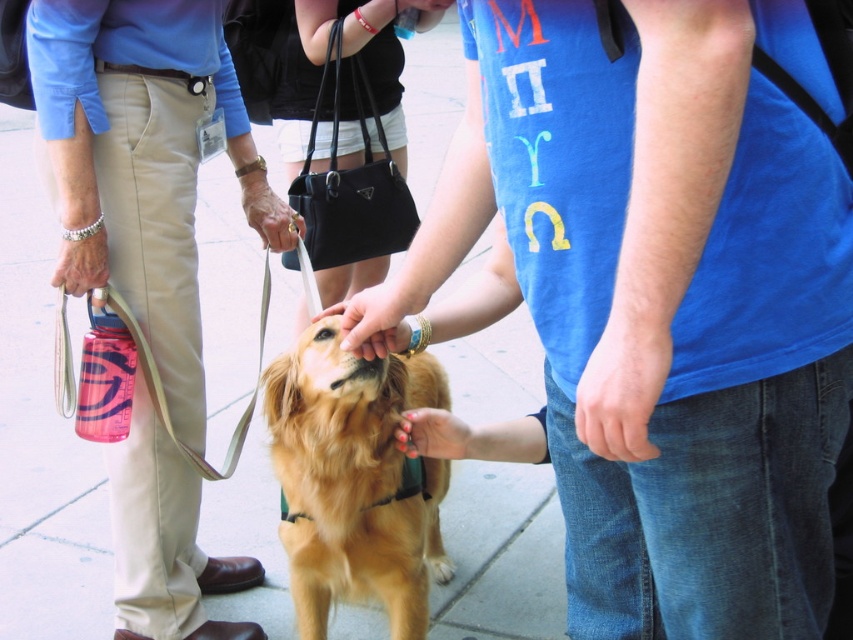
Does khaki pants at center have a lesser width compared to golden fur dog at center?

No.

I want to click on khaki pants at center, so click(143, 163).

You are a GUI agent. You are given a task and a screenshot of the screen. Output one action in this format:
    pyautogui.click(x=<x>, y=<y>)
    Task: Click on the khaki pants at center
    
    Given the screenshot: What is the action you would take?
    pyautogui.click(x=143, y=163)

How distant is blue cotton t-shirt at center from golden fur dog at center?

blue cotton t-shirt at center and golden fur dog at center are 63.50 centimeters apart from each other.

Is point (447, 253) farther from viewer compared to point (408, 524)?

No, it is in front of (408, 524).

Is point (605, 280) positioned behind point (305, 360)?

No, it is in front of (305, 360).

The width and height of the screenshot is (853, 640). Identify the location of blue cotton t-shirt at center. (659, 298).

Is blue cotton t-shirt at center positioned in front of black leather handbag at center?

Yes, blue cotton t-shirt at center is closer to the viewer.

Which is behind, point (653, 70) or point (346, 42)?

The point (346, 42) is behind.

The image size is (853, 640). I want to click on blue cotton t-shirt at center, so click(659, 298).